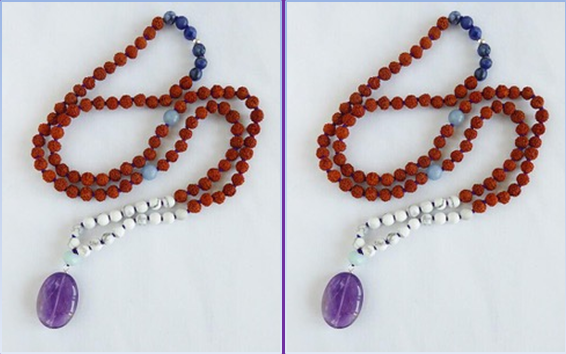
Locate an element on the screen. This screenshot has height=354, width=566. strands of red beads is located at coordinates (347, 165), (337, 173), (426, 101), (49, 177), (57, 165), (127, 104).